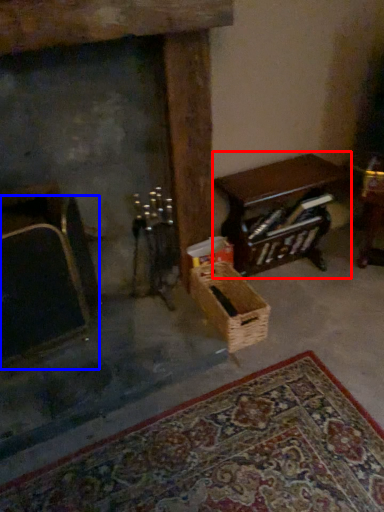
Question: Which object is further to the camera taking this photo, table (highlighted by a red box) or armchair (highlighted by a blue box)?

Choices:
 (A) table
 (B) armchair

Answer: (A)